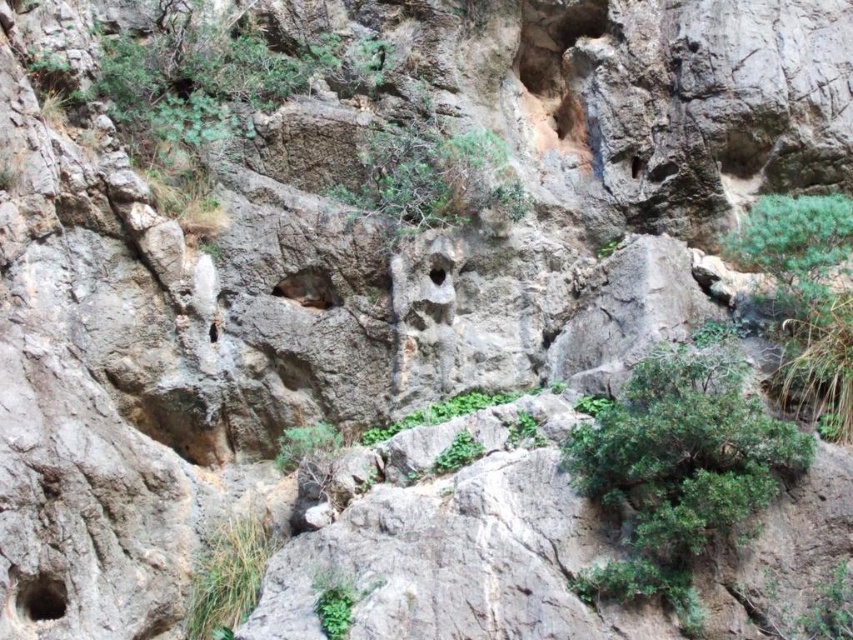
You are a hiker navigating the rugged rocky landscape. You see a green leafy shrub at center and a smooth stone hole at center. Which object is positioned to the left when viewed from your perspective?

The green leafy shrub at center is to the left of the smooth stone hole at center, so the green leafy shrub at center is positioned to the left.

Based on the photo, you are navigating through the rocky landscape and need to reach a destination. You see two points marked on your map. Which point is closer to you, point (416, 205) or point (444, 273)?

Point (416, 205) is in front of point (444, 273), so it is closer to you.